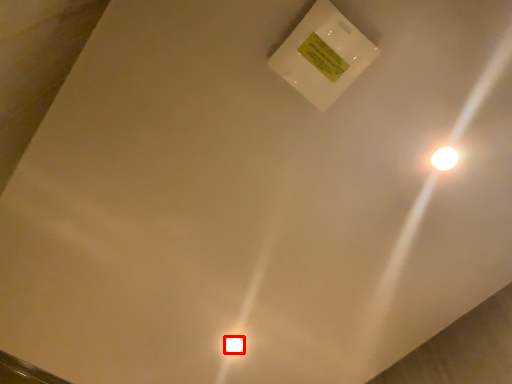
Question: In this image, where is light bulb (annotated by the red box) located relative to light?

Choices:
 (A) left
 (B) right

Answer: (A)